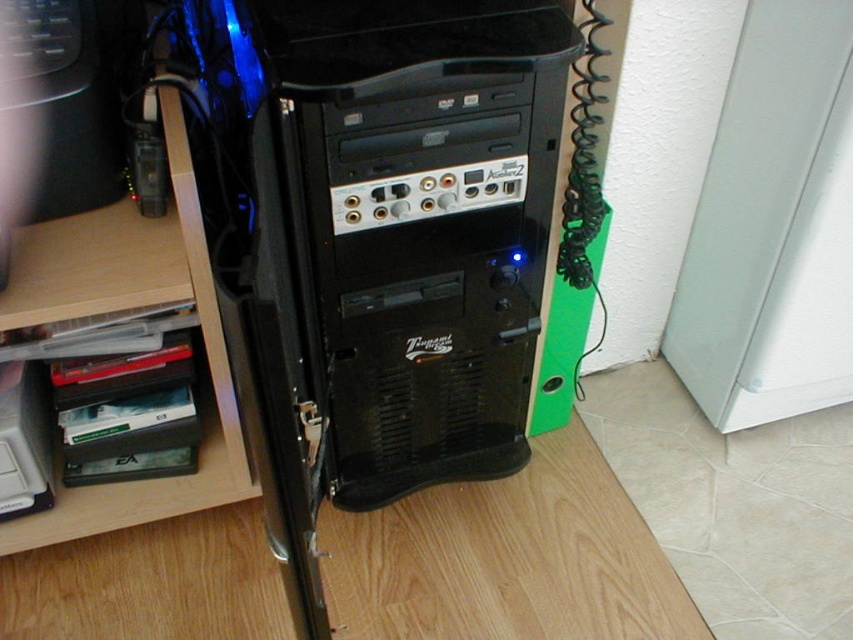
Does black plastic computer tower at center appear under wooden at left?

No.

Is black plastic computer tower at center bigger than wooden at left?

Indeed, black plastic computer tower at center has a larger size compared to wooden at left.

Identify the location of black plastic computer tower at center. This screenshot has width=853, height=640. (416, 224).